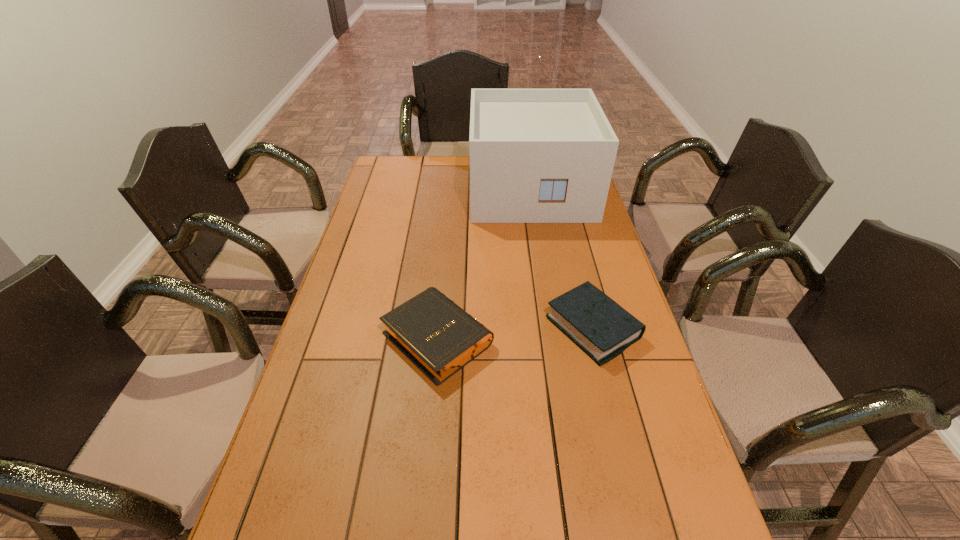
The width and height of the screenshot is (960, 540). Identify the location of the farthest object. (536, 155).

Where is `the tallest object`? The width and height of the screenshot is (960, 540). the tallest object is located at coordinates (536, 155).

Find the location of a particular element. The width and height of the screenshot is (960, 540). the left Bible is located at coordinates click(x=439, y=337).

This screenshot has width=960, height=540. In order to click on the right Bible in this screenshot , I will do `click(603, 329)`.

Where is `vacant space located on the side of the box with the window`? The height and width of the screenshot is (540, 960). vacant space located on the side of the box with the window is located at coordinates (547, 293).

Where is `free space located on the front of the left Bible`? free space located on the front of the left Bible is located at coordinates (429, 423).

Where is `vacant area located 0.100m on the left of the right Bible`? This screenshot has height=540, width=960. vacant area located 0.100m on the left of the right Bible is located at coordinates (512, 328).

Identify the location of object that is positioned at the far edge. The height and width of the screenshot is (540, 960). (536, 155).

Image resolution: width=960 pixels, height=540 pixels. Identify the location of box that is at the right edge. 536,155.

Where is `Bible that is positioned at the right edge`? Bible that is positioned at the right edge is located at coordinates (603, 329).